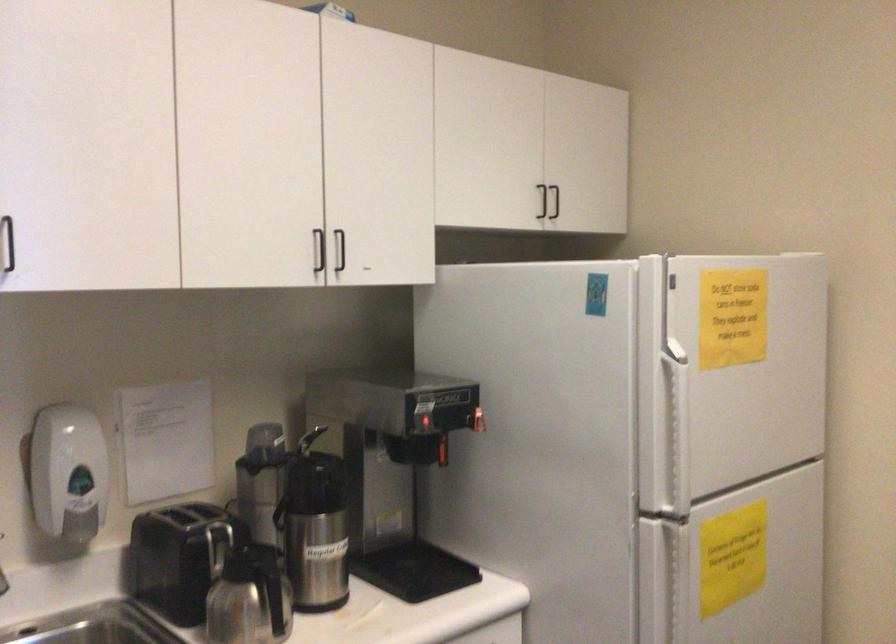
Describe the element at coordinates (192, 513) in the screenshot. I see `a toaster lever` at that location.